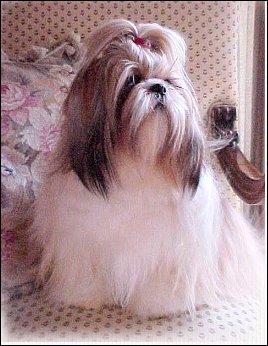
The height and width of the screenshot is (346, 268). Identify the location of seat. (109, 315).